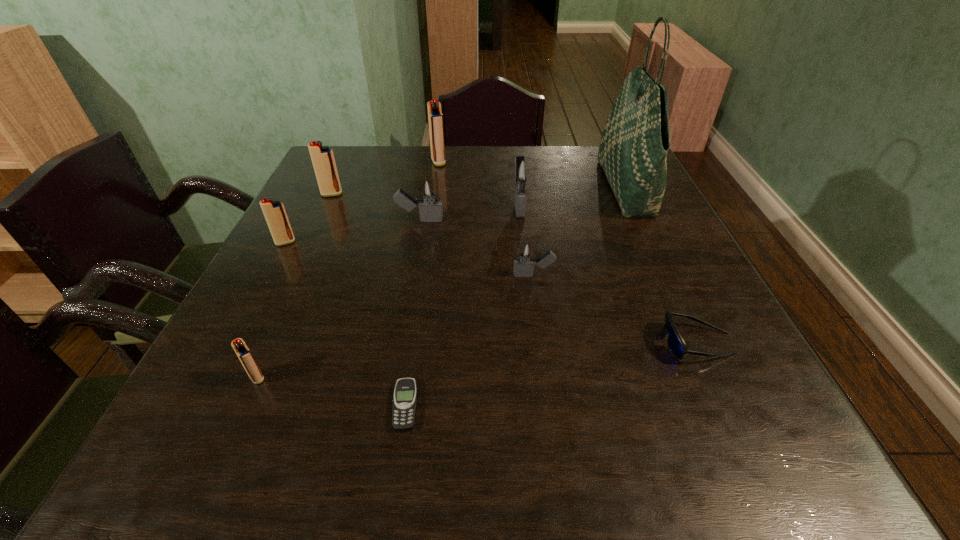
Where is `free space between the blue sunglasses and the leftmost gray igniter`? The height and width of the screenshot is (540, 960). free space between the blue sunglasses and the leftmost gray igniter is located at coordinates (559, 281).

Where is `vacant area that lies between the smallest red igniter and the blue sunglasses`? The image size is (960, 540). vacant area that lies between the smallest red igniter and the blue sunglasses is located at coordinates (477, 360).

Find the location of a particular element. This screenshot has width=960, height=540. free space between the tallest object and the gray beeper is located at coordinates (516, 296).

Locate an element on the screen. The image size is (960, 540). unoccupied position between the biggest gray igniter and the second shortest object is located at coordinates (609, 273).

The height and width of the screenshot is (540, 960). In order to click on vacant region between the beeper and the sunglasses in this screenshot , I will do `click(551, 374)`.

This screenshot has height=540, width=960. In order to click on empty location between the leftmost red igniter and the beeper in this screenshot , I will do `click(346, 324)`.

Identify the location of empty space between the third nearest object and the second biggest gray igniter. (559, 281).

Where is `free space between the tallest object and the fourth nearest object`? free space between the tallest object and the fourth nearest object is located at coordinates (580, 232).

Locate an element on the screen. object that is the third closest one to the nearest igniter is located at coordinates (428, 189).

Point out which object is positioned as the seventh nearest to the leftmost object. Please provide its 2D coordinates. Your answer should be formatted as a tuple, i.e. [(x, y)], where the tuple contains the x and y coordinates of a point satisfying the conditions above.

[(524, 251)]